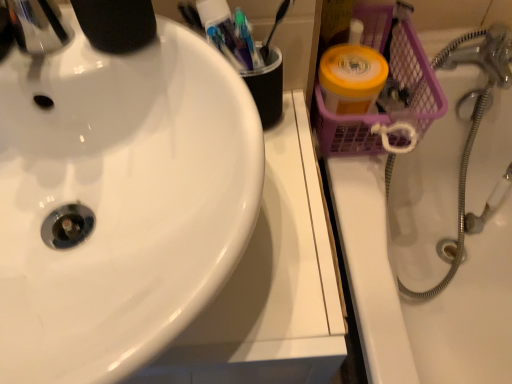
Question: In the image, is white glossy sink at left positioned in front of or behind purple mesh basket at upper right?

Choices:
 (A) front
 (B) behind

Answer: (A)

Question: Considering the positions of point (36, 135) and point (425, 249), is point (36, 135) closer or farther from the camera than point (425, 249)?

Choices:
 (A) closer
 (B) farther

Answer: (A)

Question: From a real-world perspective, relative to purple mesh basket at upper right, is white glossy sink at left vertically above or below?

Choices:
 (A) above
 (B) below

Answer: (A)

Question: Is point (465, 340) closer or farther from the camera than point (195, 226)?

Choices:
 (A) farther
 (B) closer

Answer: (A)

Question: From a real-world perspective, is purple mesh basket at upper right positioned above or below white glossy sink at left?

Choices:
 (A) below
 (B) above

Answer: (A)

Question: Looking at their shapes, would you say purple mesh basket at upper right is wider or thinner than white glossy sink at left?

Choices:
 (A) wide
 (B) thin

Answer: (B)

Question: Considering their positions, is purple mesh basket at upper right located in front of or behind white glossy sink at left?

Choices:
 (A) behind
 (B) front

Answer: (A)